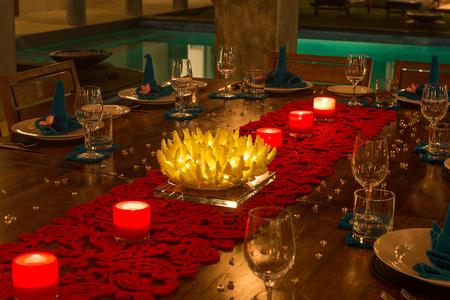
This screenshot has height=300, width=450. Identify the location of candles. (35, 282), (140, 227), (267, 139), (297, 122), (329, 108).